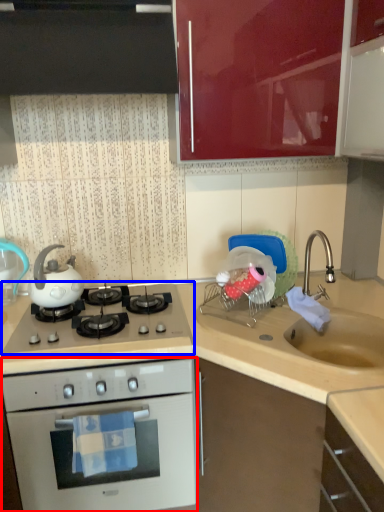
Question: Which point is closer to the camera, oven (highlighted by a red box) or gas stove (highlighted by a blue box)?

Choices:
 (A) oven
 (B) gas stove

Answer: (A)